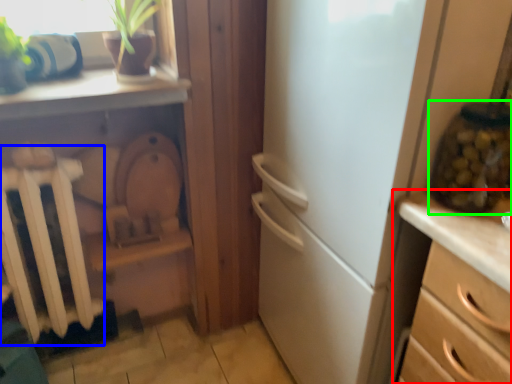
Question: Which is farther away from chest of drawers (highlighted by a red box)? radiator (highlighted by a blue box) or glass jar (highlighted by a green box)?

Choices:
 (A) radiator
 (B) glass jar

Answer: (A)